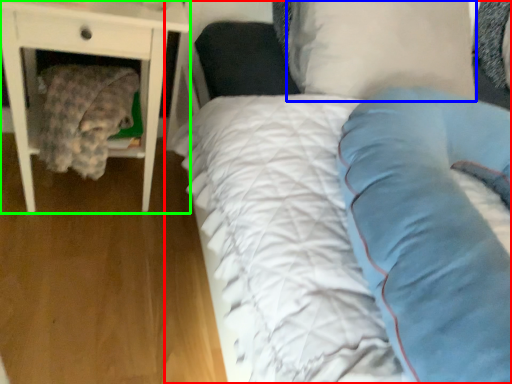
Question: Based on their relative distances, which object is nearer to bed (highlighted by a red box)? Choose from pillow (highlighted by a blue box) and nightstand (highlighted by a green box).

Choices:
 (A) pillow
 (B) nightstand

Answer: (A)